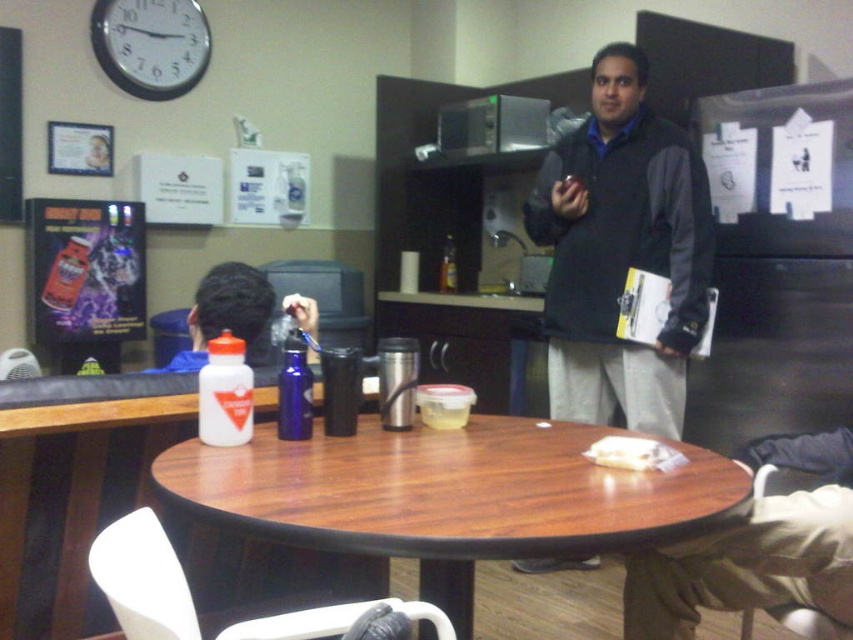
Is point (163, 58) positioned in front of point (634, 467)?

No, (163, 58) is further to viewer.

This screenshot has height=640, width=853. Describe the element at coordinates (149, 45) in the screenshot. I see `white plastic clock at upper left` at that location.

Find the location of `white plastic clock at upper left`. white plastic clock at upper left is located at coordinates (149, 45).

Is point (430, 525) positioned before point (809, 625)?

That is True.

Is point (476, 524) positioned in front of point (791, 608)?

Yes, it is in front of point (791, 608).

What are the coordinates of `wooden at center` in the screenshot? It's located at (450, 496).

Which of these two, wooden at center or white plastic chair at lower left, stands taller?

With more height is wooden at center.

Is point (218, 490) in front of point (347, 625)?

No.

At what (x,y) coordinates should I click in order to perform the action: click on wooden at center. Please return your answer as a coordinate pair (x, y). The height and width of the screenshot is (640, 853). Looking at the image, I should click on (450, 496).

Locate an element on the screen. This screenshot has width=853, height=640. wooden at center is located at coordinates (450, 496).